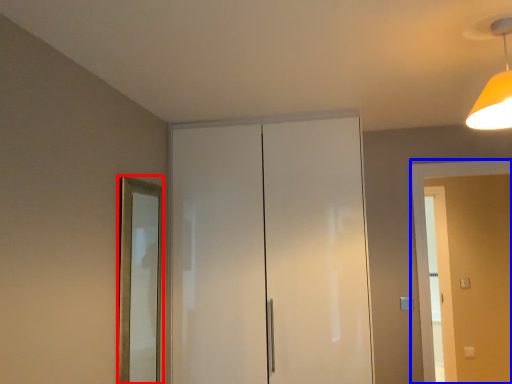
Question: Which object is closer to the camera taking this photo, mirror (highlighted by a red box) or screen door (highlighted by a blue box)?

Choices:
 (A) mirror
 (B) screen door

Answer: (A)